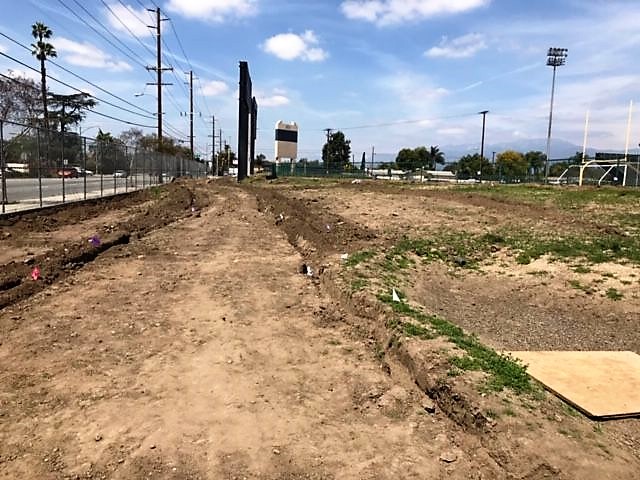
The height and width of the screenshot is (480, 640). I want to click on light, so click(x=416, y=11).